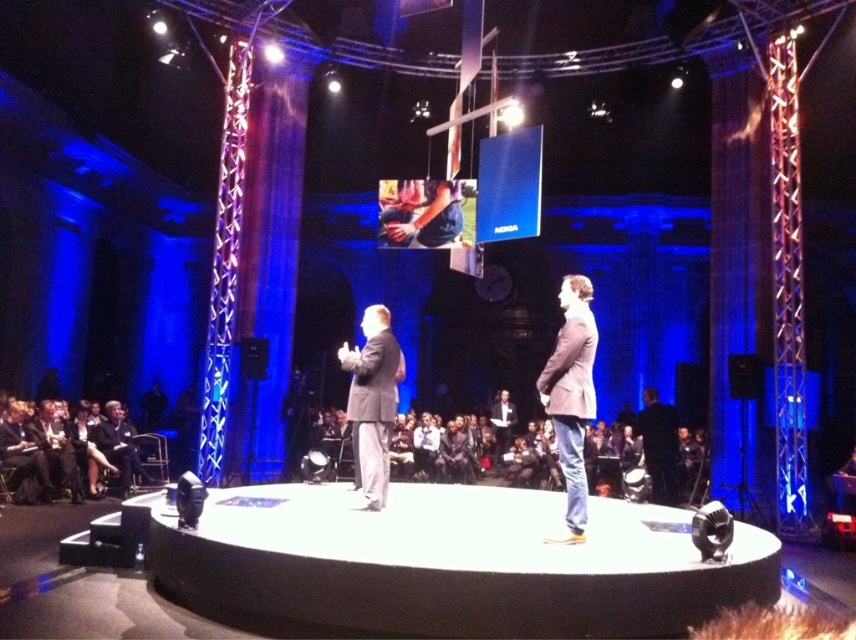
Question: Which of the following is the closest to the observer?

Choices:
 (A) matte gray suit at center
 (B) white smooth stage at center

Answer: (B)

Question: Where is matte gray suit at center located in relation to denim jacket at center in the image?

Choices:
 (A) above
 (B) below

Answer: (B)

Question: Which of these objects is positioned farthest from the denim jacket at center?

Choices:
 (A) white smooth stage at center
 (B) matte gray suit at center

Answer: (A)

Question: Can you confirm if light brown leather jacket at center is smaller than matte gray suit at center?

Choices:
 (A) yes
 (B) no

Answer: (B)

Question: Which object is positioned closest to the denim jacket at center?

Choices:
 (A) light brown leather jacket at center
 (B) matte gray suit at center
 (C) white smooth stage at center

Answer: (B)

Question: Can you confirm if light brown leather jacket at center is positioned to the right of matte gray suit at center?

Choices:
 (A) no
 (B) yes

Answer: (B)